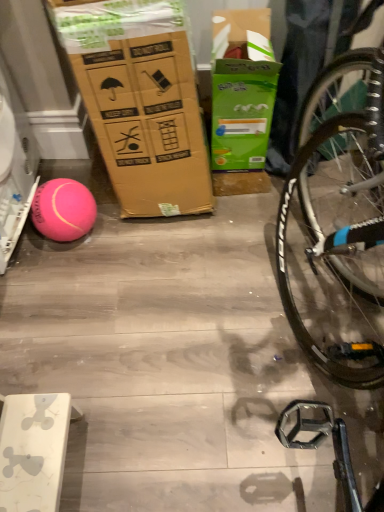
Question: From their relative heights in the image, would you say pink rubber ball at left is taller or shorter than green cardboard box at upper center?

Choices:
 (A) short
 (B) tall

Answer: (A)

Question: In the image, is pink rubber ball at left on the left side or the right side of green cardboard box at upper center?

Choices:
 (A) right
 (B) left

Answer: (B)

Question: From the image's perspective, relative to green cardboard box at upper center, is pink rubber ball at left above or below?

Choices:
 (A) below
 (B) above

Answer: (A)

Question: Relative to pink rubber ball at left, is green cardboard box at upper center in front or behind?

Choices:
 (A) front
 (B) behind

Answer: (A)

Question: From their relative heights in the image, would you say green cardboard box at upper center is taller or shorter than pink rubber ball at left?

Choices:
 (A) tall
 (B) short

Answer: (A)

Question: Is green cardboard box at upper center to the left or to the right of pink rubber ball at left in the image?

Choices:
 (A) right
 (B) left

Answer: (A)

Question: From the image's perspective, relative to pink rubber ball at left, is green cardboard box at upper center above or below?

Choices:
 (A) above
 (B) below

Answer: (A)